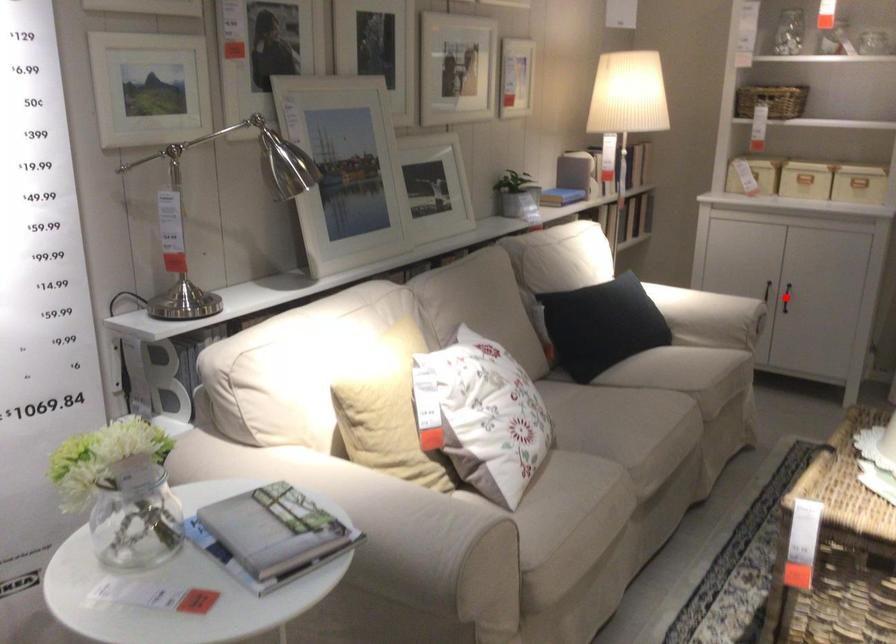
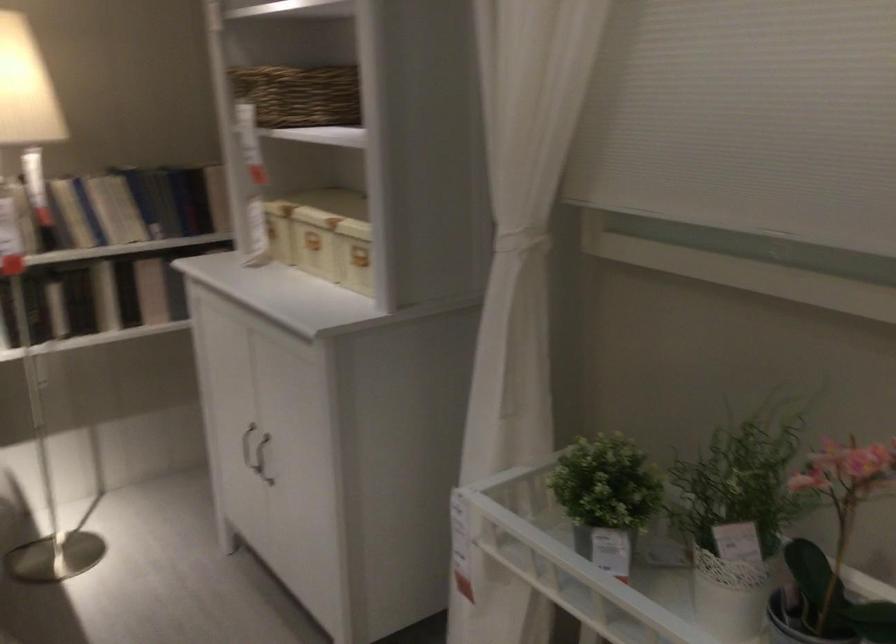
Question: I am providing you with two images of the same scene from different viewpoints. A red point is marked on the first image. Is the red point's position out of view in image 2?

Choices:
 (A) Yes
 (B) No

Answer: (A)